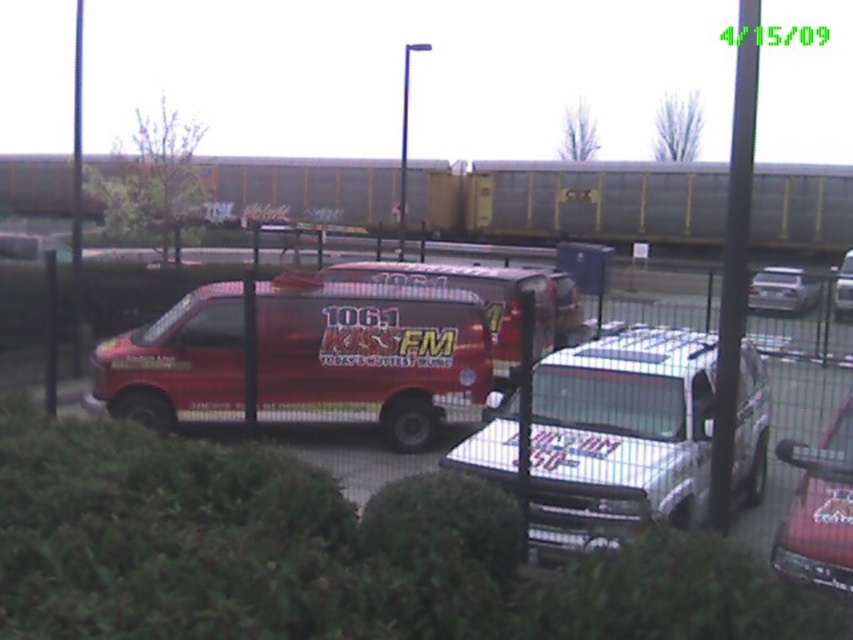
Is point (122, 488) in front of point (788, 531)?

That is True.

This screenshot has width=853, height=640. Find the location of `green leafy hedge at lower center`. green leafy hedge at lower center is located at coordinates (328, 554).

Which of these two, metallic wire fence at center or white glossy truck at center, stands taller?

Standing taller between the two is metallic wire fence at center.

Does metallic wire fence at center come in front of white glossy truck at center?

Yes, it is in front of white glossy truck at center.

Is point (785, 372) positioned after point (468, 464)?

That is False.

You are a GUI agent. You are given a task and a screenshot of the screen. Output one action in this format:
    pyautogui.click(x=<x>, y=<y>)
    Task: Click on the metallic wire fence at center
    Image resolution: width=853 pixels, height=640 pixels.
    Given the screenshot: What is the action you would take?
    pyautogui.click(x=621, y=435)

This screenshot has height=640, width=853. Describe the element at coordinates (619, 436) in the screenshot. I see `white glossy truck at center` at that location.

Can you confirm if white glossy truck at center is wider than metallic red van at center?

Yes.

What do you see at coordinates (619, 436) in the screenshot?
I see `white glossy truck at center` at bounding box center [619, 436].

Identify the location of white glossy truck at center. This screenshot has width=853, height=640. (619, 436).